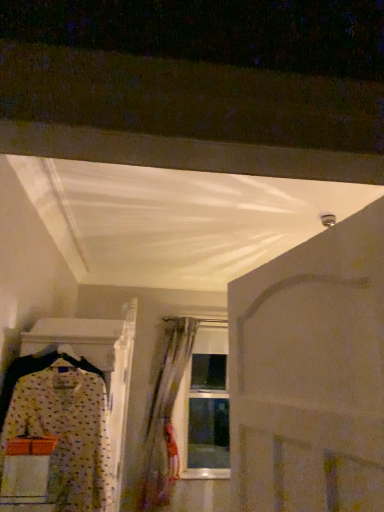
Question: Is translucent fabric curtain at center taller or shorter than white matte door at center?

Choices:
 (A) tall
 (B) short

Answer: (A)

Question: Visually, is translucent fabric curtain at center positioned to the left or to the right of white matte door at center?

Choices:
 (A) left
 (B) right

Answer: (A)

Question: Based on their relative distances, which object is farther from the translucent fabric curtain at center?

Choices:
 (A) polka dot fabric dress at left
 (B) white matte door at center

Answer: (B)

Question: Estimate the real-world distances between objects in this image. Which object is farther from the white matte door at center?

Choices:
 (A) polka dot fabric dress at left
 (B) translucent fabric curtain at center

Answer: (B)